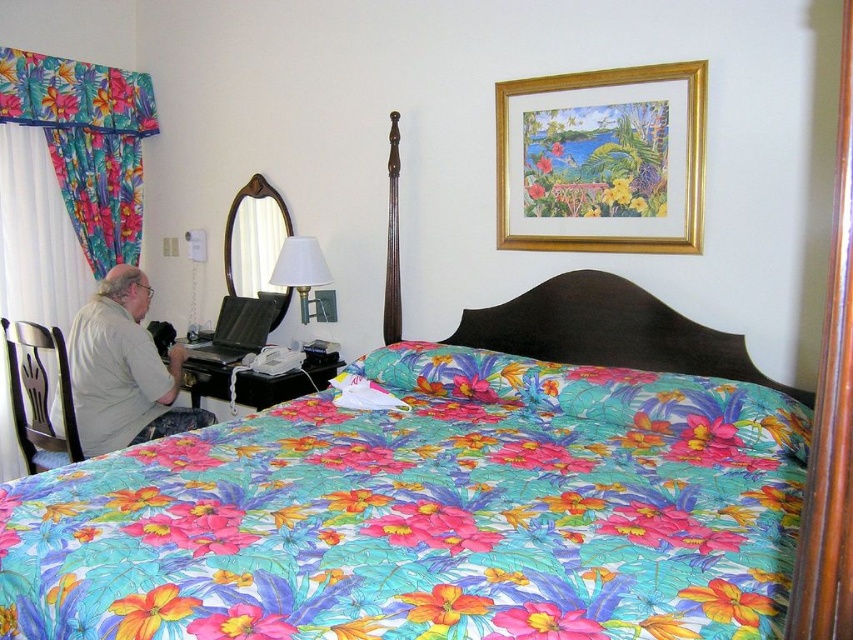
Question: Can you confirm if floral fabric curtain at left is positioned to the left of white fabric lampshade at upper center?

Choices:
 (A) yes
 (B) no

Answer: (A)

Question: Does gold-framed painting at upper center come in front of white fabric lampshade at upper center?

Choices:
 (A) yes
 (B) no

Answer: (A)

Question: Which of these objects is positioned closest to the gray cotton shirt at left?

Choices:
 (A) white fabric lampshade at upper center
 (B) floral fabric curtain at left

Answer: (A)

Question: Which of the following is the closest to the observer?

Choices:
 (A) gold-framed painting at upper center
 (B) floral fabric curtain at left
 (C) gray cotton shirt at left

Answer: (A)

Question: Among these objects, which one is nearest to the camera?

Choices:
 (A) floral fabric curtain at left
 (B) white fabric lampshade at upper center
 (C) gold-framed painting at upper center
 (D) gray cotton shirt at left

Answer: (C)

Question: Is floral fabric curtain at left below white fabric lampshade at upper center?

Choices:
 (A) yes
 (B) no

Answer: (B)